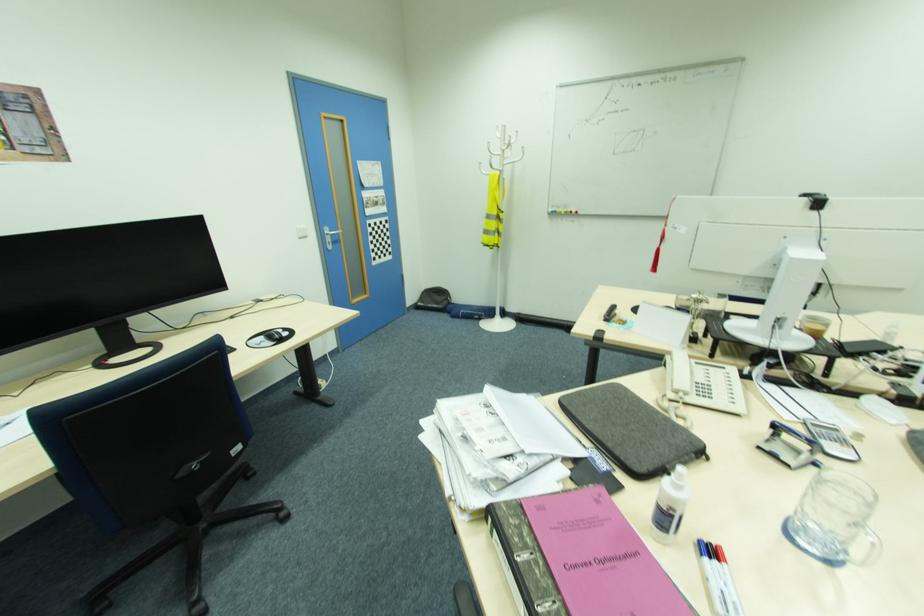
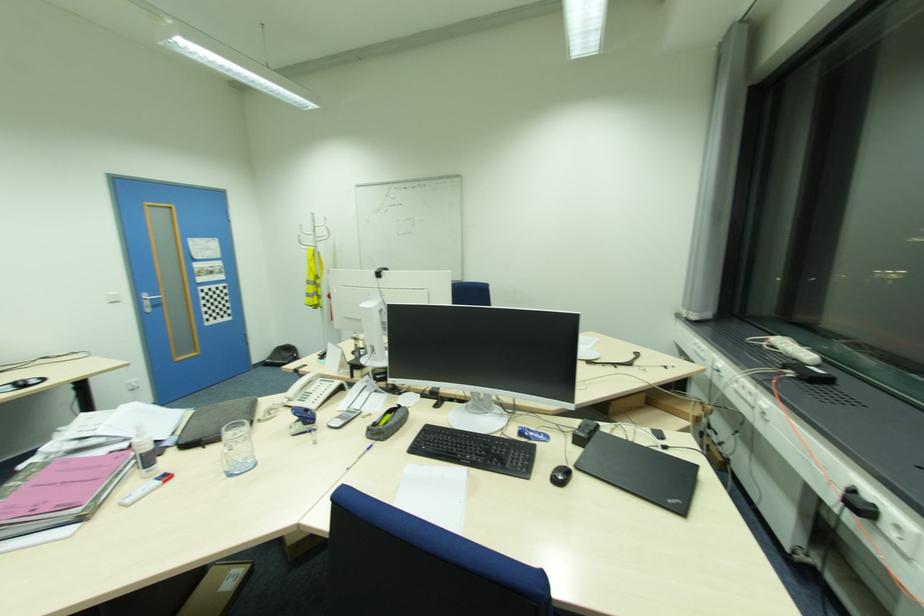
From the picture: What movement of the cameraman would produce the second image?

The movement direction of the cameraman is right, backward.